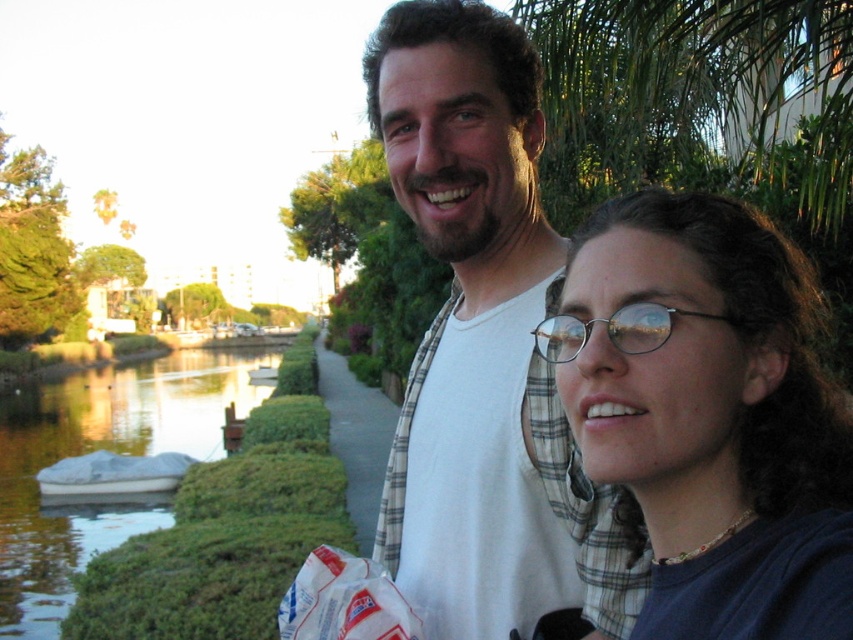
Is white cotton shirt at center above matte black glasses at center?

Yes.

Between white cotton shirt at center and matte black glasses at center, which one has more height?

white cotton shirt at center is taller.

Between point (566, 500) and point (685, 330), which one is positioned behind?

The point (566, 500) is behind.

Where is `white cotton shirt at center`? This screenshot has height=640, width=853. white cotton shirt at center is located at coordinates (485, 346).

Can you confirm if white cotton shirt at center is wider than clear plastic glasses at center?

Yes, white cotton shirt at center is wider than clear plastic glasses at center.

Who is taller, white cotton shirt at center or clear plastic glasses at center?

Standing taller between the two is white cotton shirt at center.

You are a GUI agent. You are given a task and a screenshot of the screen. Output one action in this format:
    pyautogui.click(x=<x>, y=<y>)
    Task: Click on the white cotton shirt at center
    The height and width of the screenshot is (640, 853).
    Given the screenshot: What is the action you would take?
    pyautogui.click(x=485, y=346)

The image size is (853, 640). What are the coordinates of `white cotton shirt at center` in the screenshot? It's located at (485, 346).

Is point (682, 624) farther from viewer compared to point (635, 346)?

No, it is in front of (635, 346).

Does matte black glasses at center appear on the left side of clear plastic glasses at center?

In fact, matte black glasses at center is to the right of clear plastic glasses at center.

In the scene shown: Measure the distance between matte black glasses at center and camera.

4.62 feet

The width and height of the screenshot is (853, 640). I want to click on matte black glasses at center, so click(711, 413).